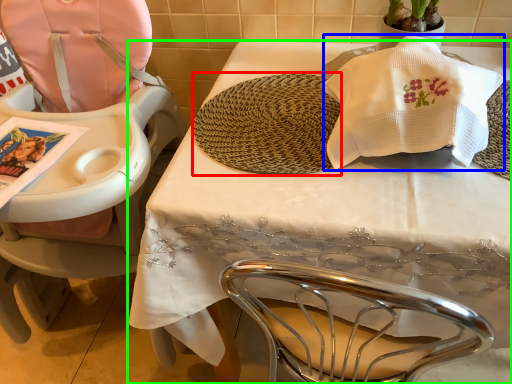
Question: Which is farther away from mat (highlighted by a red box)? blanket (highlighted by a blue box) or table (highlighted by a green box)?

Choices:
 (A) blanket
 (B) table

Answer: (A)